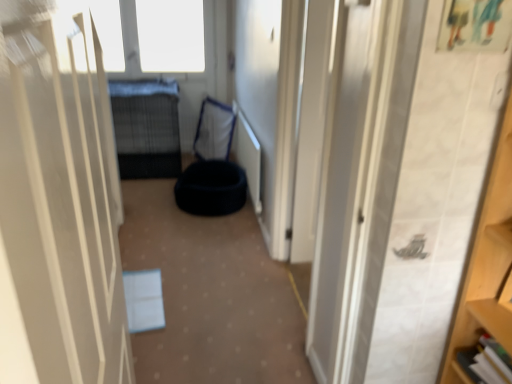
Question: From the image's perspective, does black wire mesh bed at center appear lower than black fabric bean bag at center, the 2th bean bag chair positioned from the front?

Choices:
 (A) no
 (B) yes

Answer: (A)

Question: Considering the relative sizes of black wire mesh bed at center and black fabric bean bag at center, the 2th bean bag chair positioned from the front, in the image provided, is black wire mesh bed at center bigger than black fabric bean bag at center, the 2th bean bag chair positioned from the front,?

Choices:
 (A) no
 (B) yes

Answer: (B)

Question: Is black wire mesh bed at center far away from black fabric bean bag at center, the 2th bean bag chair positioned from the front?

Choices:
 (A) no
 (B) yes

Answer: (A)

Question: From a real-world perspective, is black wire mesh bed at center over black fabric bean bag at center, the 2th bean bag chair positioned from the front?

Choices:
 (A) yes
 (B) no

Answer: (A)

Question: Could you tell me if black wire mesh bed at center is facing black fabric bean bag at center, the 1th bean bag chair in the back-to-front sequence?

Choices:
 (A) no
 (B) yes

Answer: (A)

Question: Considering the relative positions of black wire mesh bed at center and black fabric bean bag at center, the 2th bean bag chair positioned from the front, in the image provided, is black wire mesh bed at center to the left of black fabric bean bag at center, the 2th bean bag chair positioned from the front, from the viewer's perspective?

Choices:
 (A) no
 (B) yes

Answer: (B)

Question: Is white matte door at center to the left of black wire mesh bed at center from the viewer's perspective?

Choices:
 (A) yes
 (B) no

Answer: (B)

Question: Considering the relative positions of white matte door at center and black wire mesh bed at center in the image provided, is white matte door at center behind black wire mesh bed at center?

Choices:
 (A) no
 (B) yes

Answer: (A)

Question: Is black wire mesh bed at center a part of white matte door at center?

Choices:
 (A) no
 (B) yes

Answer: (A)

Question: Is white matte door at center oriented away from black wire mesh bed at center?

Choices:
 (A) yes
 (B) no

Answer: (B)

Question: Can you confirm if white matte door at center is taller than black wire mesh bed at center?

Choices:
 (A) yes
 (B) no

Answer: (A)

Question: From the image's perspective, is white matte door at center over black wire mesh bed at center?

Choices:
 (A) yes
 (B) no

Answer: (B)

Question: Is black fabric bean bag at center, arranged as the second bean bag chair when viewed from the back, smaller than black fabric bean bag at center, the 2th bean bag chair positioned from the front?

Choices:
 (A) no
 (B) yes

Answer: (B)